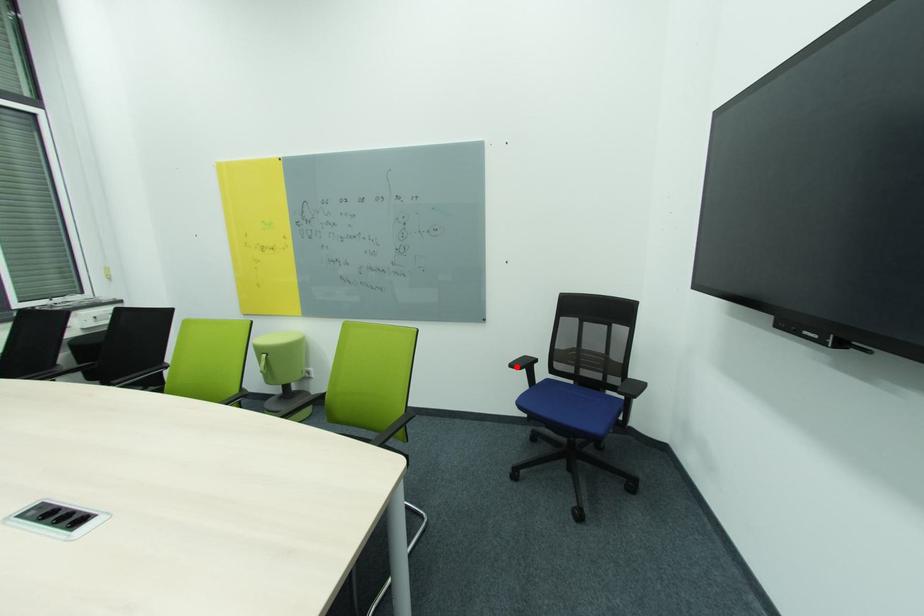
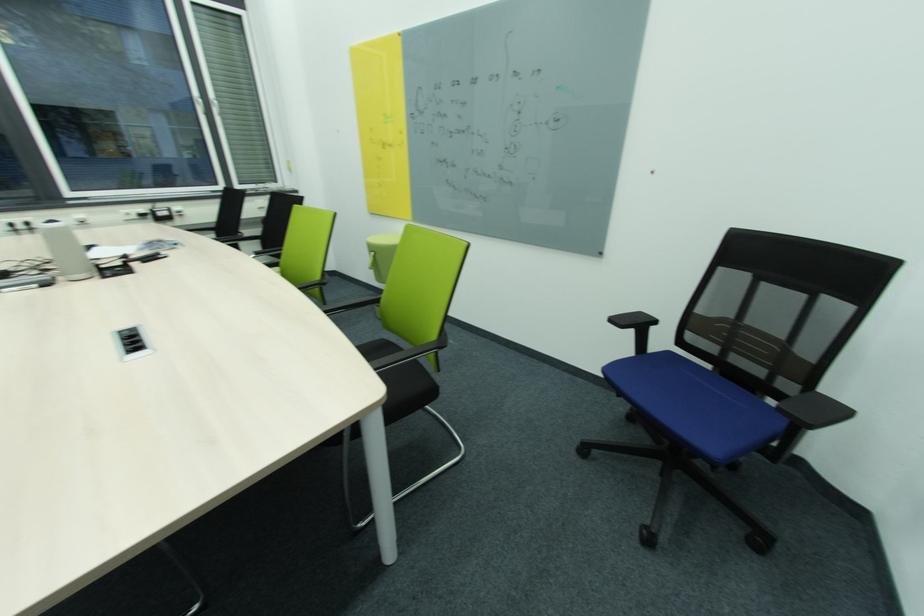
In the second image, find the point that corresponds to the highlighted location in the first image.

(617, 321)